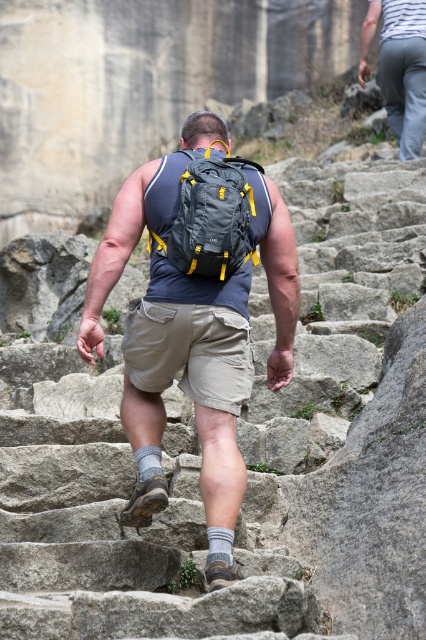
You are a hiker trying to decide which path to take up the stone steps. You notice two people ahead wearing khaki cotton shorts at center and gray cotton pants at upper right. Which clothing item is positioned to the left of the other?

The khaki cotton shorts at center are to the left of the gray cotton pants at upper right.

You are a hiker who just started climbing these ancient stone steps. You notice your gray fabric backpack at center and khaki cotton shorts at center. Which item is positioned higher relative to your body?

The gray fabric backpack at center is located above the khaki cotton shorts at center, so the backpack is higher on your body.